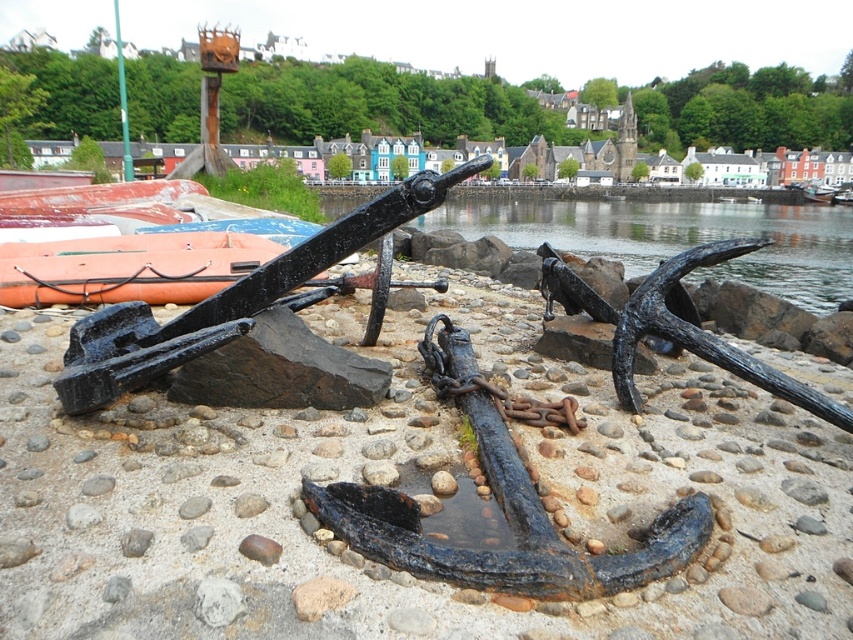
The width and height of the screenshot is (853, 640). Find the location of `clear water at center`. clear water at center is located at coordinates (674, 237).

Can you confirm if clear water at center is bigger than orange rubber boat at left?

Indeed, clear water at center has a larger size compared to orange rubber boat at left.

Does point (614, 227) come closer to viewer compared to point (178, 298)?

That is False.

Identify the location of clear water at center. The width and height of the screenshot is (853, 640). click(x=674, y=237).

Who is more distant from viewer, [28,502] or [57,294]?

Point [57,294]

Does rusty metal anchor at center lie behind orange rubber boat at left?

No, it is in front of orange rubber boat at left.

The height and width of the screenshot is (640, 853). I want to click on rusty metal anchor at center, so click(x=409, y=493).

Does rusty metal anchor at center have a greater height compared to clear water at center?

No.

Can you confirm if rusty metal anchor at center is positioned to the left of clear water at center?

Yes, rusty metal anchor at center is to the left of clear water at center.

Looking at this image, who is more distant from viewer, (148, 484) or (329, 214)?

The point (329, 214) is behind.

This screenshot has width=853, height=640. I want to click on rusty metal anchor at center, so click(409, 493).